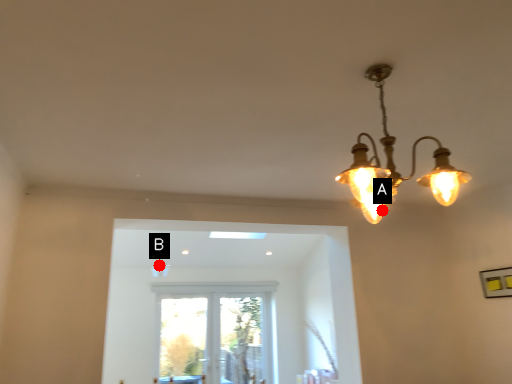
Question: Two points are circled on the image, labeled by A and B beside each circle. Which point is closer to the camera?

Choices:
 (A) A is closer
 (B) B is closer

Answer: (A)